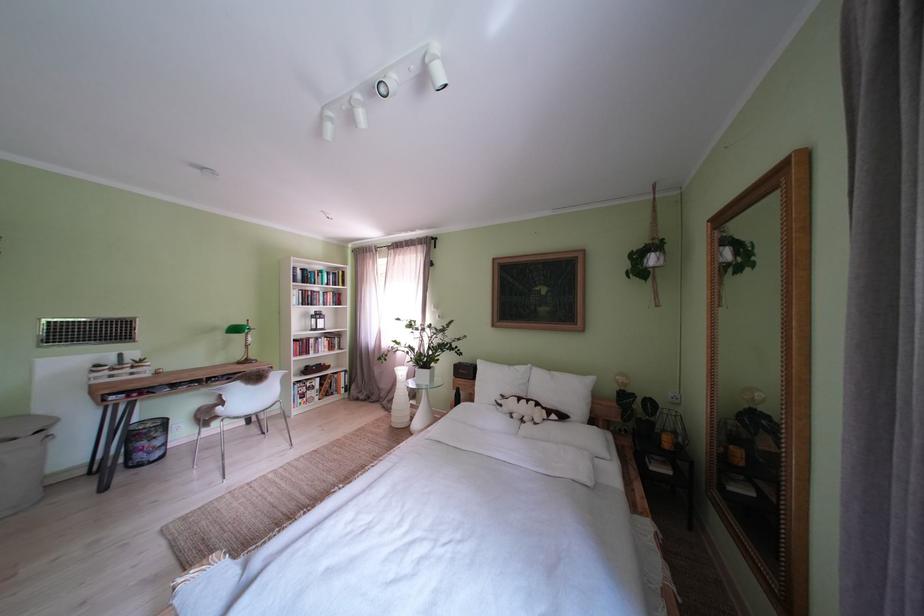
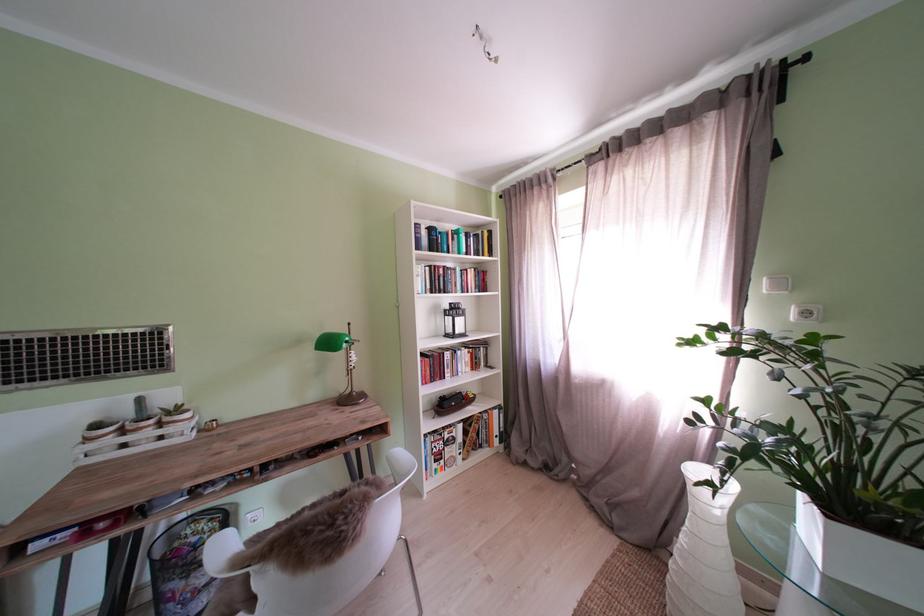
Where in the second image is the point corresponding to (x=319, y=359) from the first image?

(454, 382)